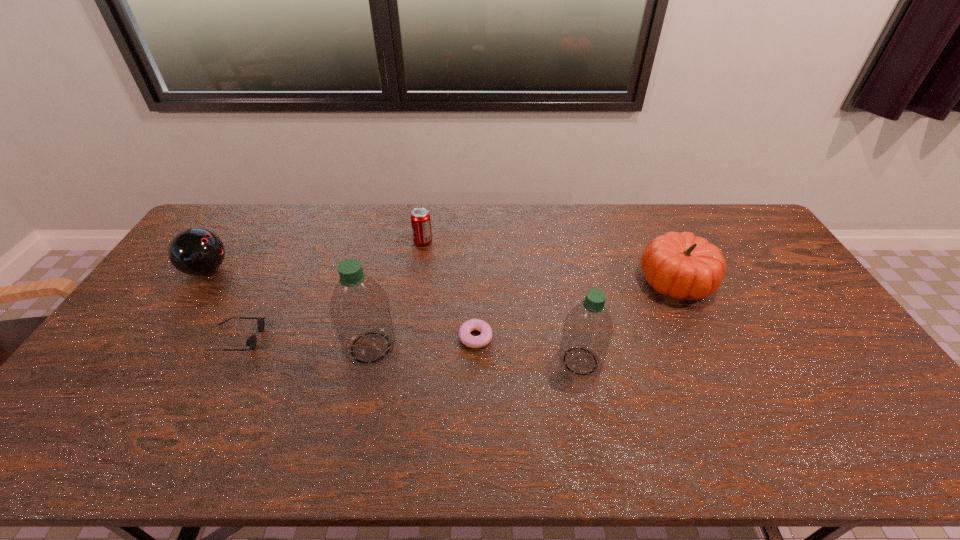
Image resolution: width=960 pixels, height=540 pixels. Find the location of `object that is positioned at the left edge`. object that is positioned at the left edge is located at coordinates (194, 251).

In order to click on free point at the far edge in this screenshot , I will do `click(637, 233)`.

At what (x,y) coordinates should I click in order to perform the action: click on vacant area at the near edge of the desktop. Please return your answer as a coordinate pair (x, y). This screenshot has height=540, width=960. Looking at the image, I should click on (344, 410).

Locate an element on the screen. This screenshot has width=960, height=540. vacant region at the left edge of the desktop is located at coordinates (124, 352).

Find the location of a particular element. The image size is (960, 540). vacant space at the right edge of the desktop is located at coordinates (764, 255).

In the image, there is a desktop. Find the location of `vacant space at the far left corner`. vacant space at the far left corner is located at coordinates pyautogui.click(x=234, y=220).

The image size is (960, 540). I want to click on vacant space at the near left corner of the desktop, so click(x=113, y=409).

Find the location of a particular element. The width and height of the screenshot is (960, 540). free space at the far right corner is located at coordinates (730, 239).

At what (x,y) coordinates should I click in order to perform the action: click on free location at the near right corner of the desktop. Please return your answer as a coordinate pair (x, y). The height and width of the screenshot is (540, 960). Looking at the image, I should click on (831, 399).

The width and height of the screenshot is (960, 540). Identify the location of free space that is in between the sunglasses and the pumpkin. (457, 310).